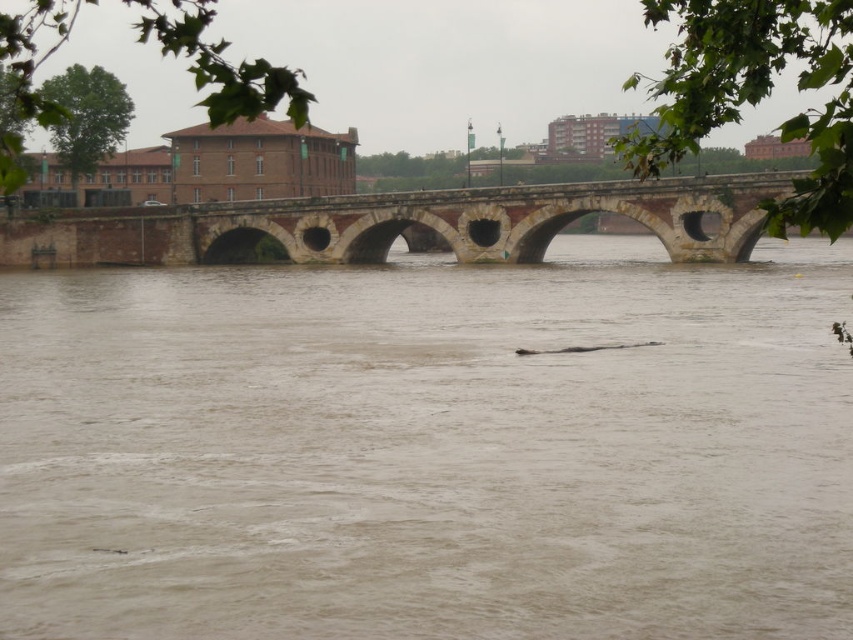
Does brown muddy water at center have a greater height compared to brown stone bridge at center?

Yes.

In the scene shown: Can you confirm if brown muddy water at center is shorter than brown stone bridge at center?

Incorrect, brown muddy water at center's height does not fall short of brown stone bridge at center's.

Is point (456, 515) less distant than point (312, 257)?

Yes, it is.

Where is `brown muddy water at center`? This screenshot has height=640, width=853. brown muddy water at center is located at coordinates (428, 449).